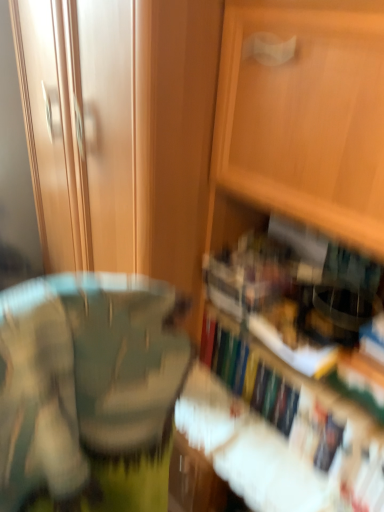
Question: Considering the positions of point (337, 410) and point (241, 65), is point (337, 410) closer or farther from the camera than point (241, 65)?

Choices:
 (A) closer
 (B) farther

Answer: (B)

Question: From a real-world perspective, is hardcover book at lower right positioned above or below wooden cabinet at center?

Choices:
 (A) above
 (B) below

Answer: (B)

Question: Is hardcover book at lower right inside the boundaries of wooden cabinet at center, or outside?

Choices:
 (A) outside
 (B) inside

Answer: (B)

Question: In terms of width, does wooden cabinet at center look wider or thinner when compared to hardcover book at lower right?

Choices:
 (A) wide
 (B) thin

Answer: (A)

Question: Is wooden cabinet at center in front of or behind hardcover book at lower right in the image?

Choices:
 (A) front
 (B) behind

Answer: (A)

Question: Is wooden cabinet at center inside or outside of hardcover book at lower right?

Choices:
 (A) outside
 (B) inside

Answer: (A)

Question: Would you say wooden cabinet at center is to the left or to the right of hardcover book at lower right in the picture?

Choices:
 (A) left
 (B) right

Answer: (A)